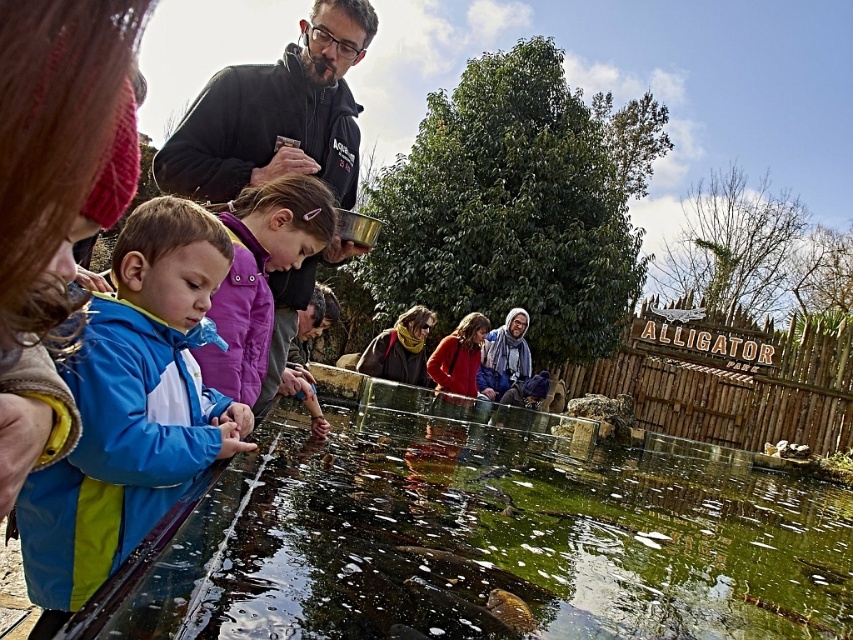
You are a parent at the scene and want to take a photo of your child with the green glassy water at lower center and the blue fleece jacket at left. Which object should you focus on first to ensure both are in the frame?

You should focus on the green glassy water at lower center first because it is in front of the blue fleece jacket at left, so positioning the camera to capture the water will naturally include the jacket in the background.

Based on the photo, you are a parent at the scene and want to ensure your child stays warm. You see two jackets on the left side of the enclosure. Which jacket is taller and thus more likely to provide better coverage against the wind? The blue waterproof jacket at left or the blue fleece jacket at left?

The blue waterproof jacket at left is taller than the blue fleece jacket at left, so it provides better coverage against the wind.